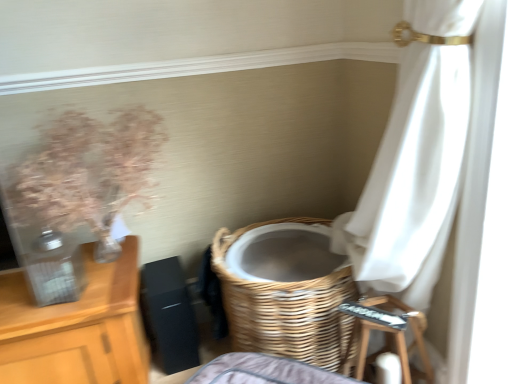
Question: Should I look upward or downward to see translucent glass vase at left?

Choices:
 (A) up
 (B) down

Answer: (A)

Question: Can you confirm if wooden step stool at lower right is smaller than translucent glass vase at left?

Choices:
 (A) no
 (B) yes

Answer: (B)

Question: Is wooden step stool at lower right shorter than translucent glass vase at left?

Choices:
 (A) yes
 (B) no

Answer: (A)

Question: Can you confirm if wooden step stool at lower right is taller than translucent glass vase at left?

Choices:
 (A) yes
 (B) no

Answer: (B)

Question: Is wooden step stool at lower right to the left of translucent glass vase at left from the viewer's perspective?

Choices:
 (A) no
 (B) yes

Answer: (A)

Question: From a real-world perspective, is wooden step stool at lower right physically below translucent glass vase at left?

Choices:
 (A) no
 (B) yes

Answer: (B)

Question: Is wooden step stool at lower right beside translucent glass vase at left?

Choices:
 (A) no
 (B) yes

Answer: (A)

Question: Does woven wood basket at lower center have a larger size compared to wooden step stool at lower right?

Choices:
 (A) yes
 (B) no

Answer: (A)

Question: Is woven wood basket at lower center taller than wooden step stool at lower right?

Choices:
 (A) yes
 (B) no

Answer: (A)

Question: Is woven wood basket at lower center aimed at wooden step stool at lower right?

Choices:
 (A) no
 (B) yes

Answer: (A)

Question: Does woven wood basket at lower center appear on the left side of wooden step stool at lower right?

Choices:
 (A) no
 (B) yes

Answer: (B)

Question: Can you confirm if woven wood basket at lower center is wider than wooden step stool at lower right?

Choices:
 (A) no
 (B) yes

Answer: (B)

Question: From a real-world perspective, is woven wood basket at lower center positioned over wooden step stool at lower right based on gravity?

Choices:
 (A) yes
 (B) no

Answer: (A)

Question: Is translucent glass vase at left outside of wooden step stool at lower right?

Choices:
 (A) no
 (B) yes

Answer: (B)